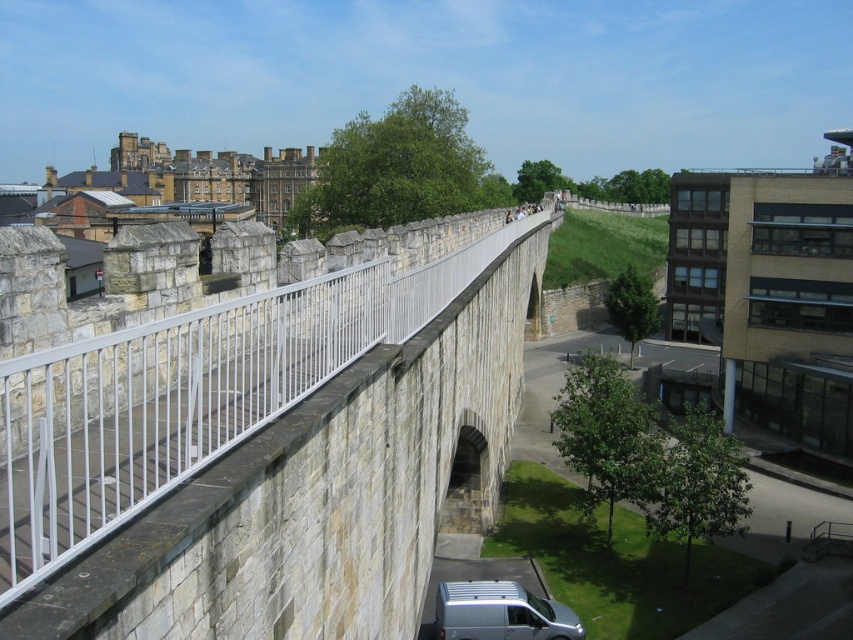
Consider the image. You are standing near the stone bridge at center and want to take a photo of the silver metallic van at lower center. Which object should you move towards to get a better view of the van?

The stone bridge at center is closer to the viewer than the silver metallic van at lower center. To get a better view of the silver metallic van at lower center, you should move towards the silver metallic van at lower center to reduce the distance between you and the van.

You are a delivery driver who needs to park your van that is 16 meters long. You see the stone bridge at center and the modern building to the right. Is there enough space between them to park your van?

The distance between the stone bridge at center and the modern building to the right is 16.97 meters. Since your van is 16 meters long, there is enough space to park it between them.

You are standing at the historic stone wall structure and want to walk from the silver van to the modern building with large windows. There are two points marked on the path. Which point should you step on first, point (424, 532) or point (439, 596)?

You should step on point (424, 532) first because it is in front of point (439, 596) along the path from the silver van to the modern building with large windows.